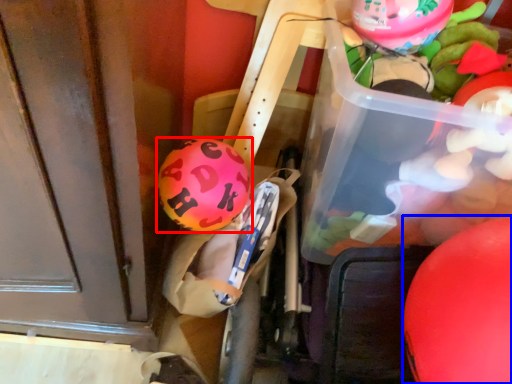
Question: Which of the following is the farthest to the observer, balloon (highlighted by a red box) or balloon (highlighted by a blue box)?

Choices:
 (A) balloon
 (B) balloon

Answer: (A)